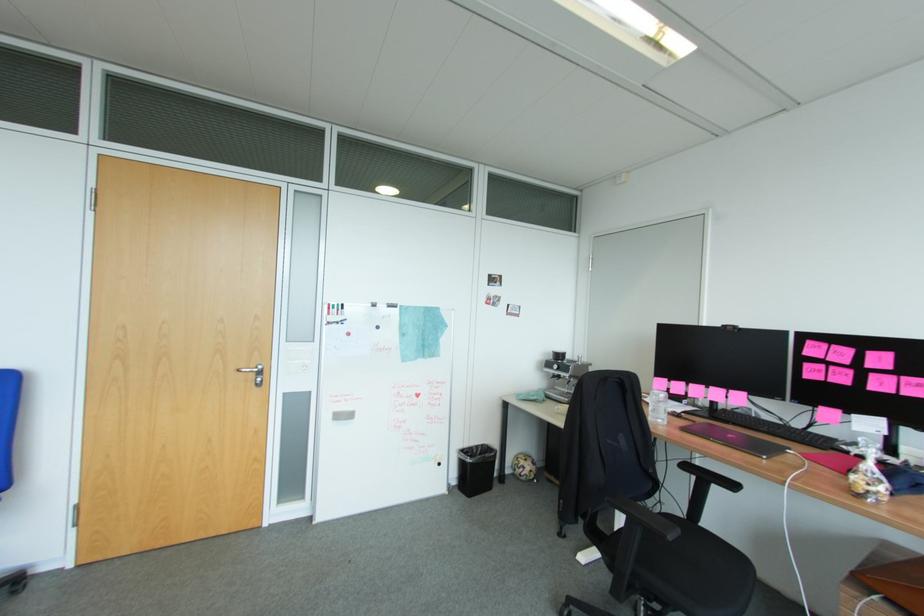
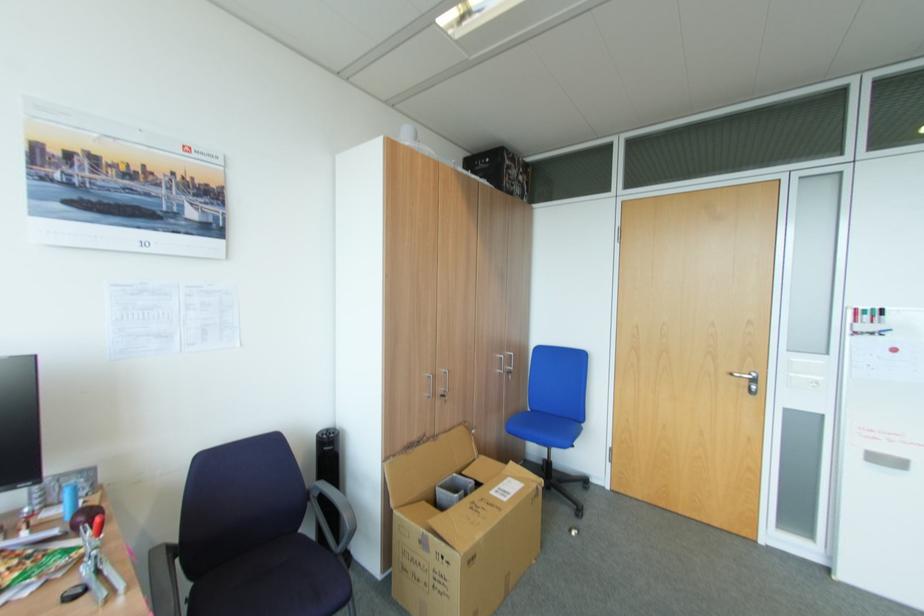
Question: How did the camera likely rotate?

Choices:
 (A) Left
 (B) Right
 (C) Up
 (D) Down

Answer: (A)